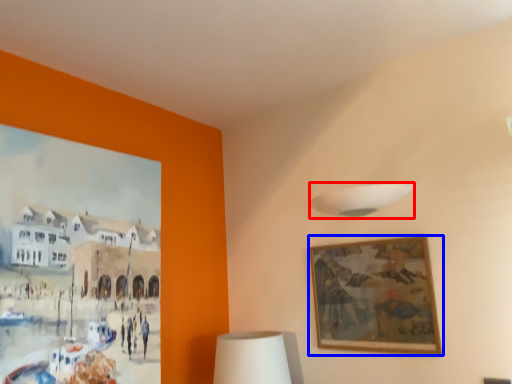
Question: Which object appears closest to the camera in this image, lamp (highlighted by a red box) or picture frame (highlighted by a blue box)?

Choices:
 (A) lamp
 (B) picture frame

Answer: (B)